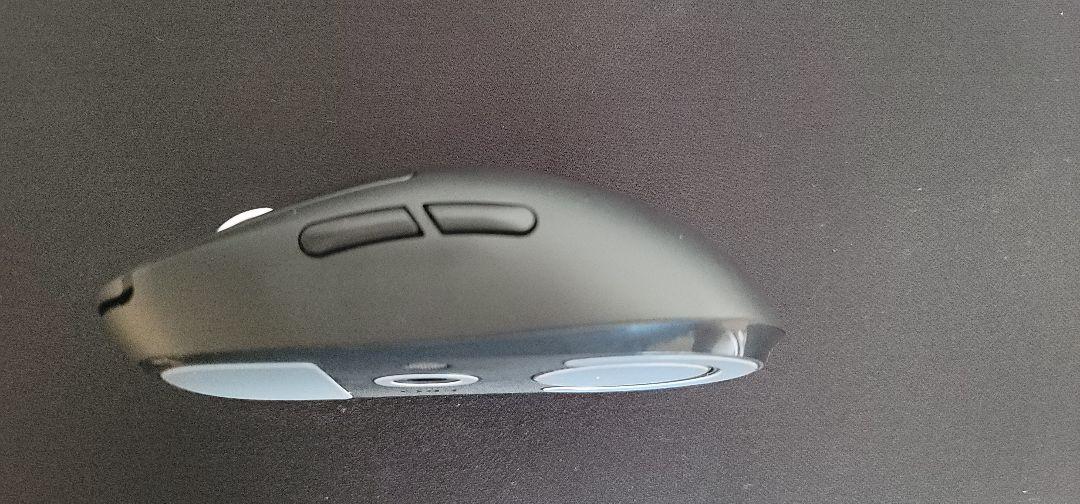
The width and height of the screenshot is (1080, 504). I want to click on mouse pad, so click(x=478, y=285).